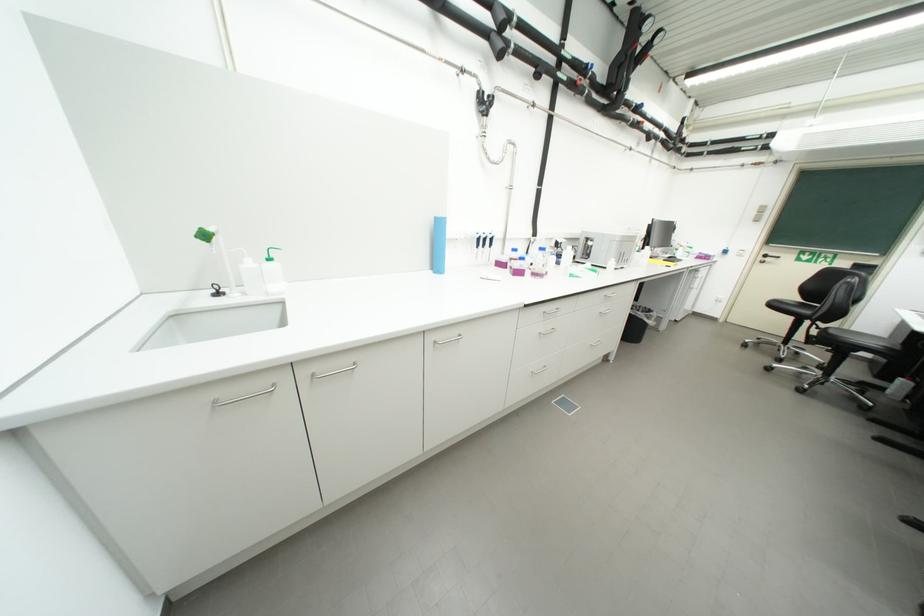
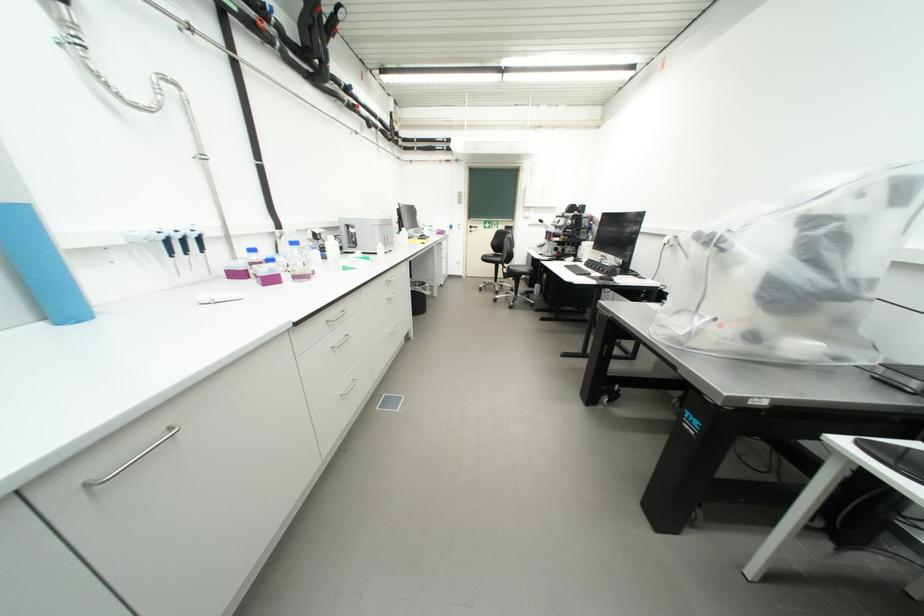
Question: How did the camera likely rotate?

Choices:
 (A) Left
 (B) Right
 (C) Up
 (D) Down

Answer: (B)